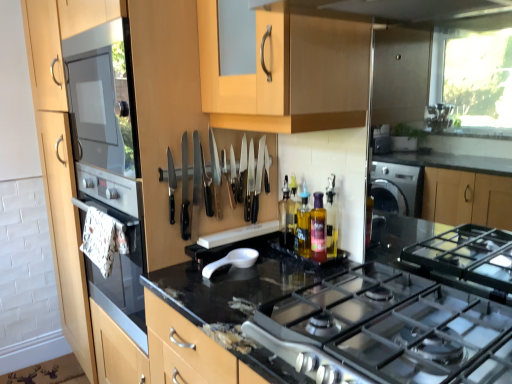
Where is `black granite countertop at center`? The height and width of the screenshot is (384, 512). black granite countertop at center is located at coordinates (349, 321).

The width and height of the screenshot is (512, 384). I want to click on translucent plastic bottle at center, the 3th bottle from the back, so click(318, 229).

Describe the element at coordinates (233, 260) in the screenshot. I see `white matte spoon at center` at that location.

Find the location of a particular element. Image resolution: width=512 pixels, height=384 pixels. black granite countertop at center is located at coordinates (349, 321).

Does point (228, 261) come closer to viewer compared to point (319, 228)?

No, it is not.

Which of these two, white matte spoon at center or translucent plastic bottle at center, placed as the first bottle when sorted from front to back, stands taller?

translucent plastic bottle at center, placed as the first bottle when sorted from front to back.

Is white matte spoon at center aimed at translucent plastic bottle at center, the 3th bottle from the back?

No, white matte spoon at center is not facing towards translucent plastic bottle at center, the 3th bottle from the back.

From a real-world perspective, which object stands above the other?

translucent plastic bottle at center, placed as the first bottle when sorted from front to back.

From the image's perspective, is translucent plastic bottle at center, the 3th bottle from the back, over black granite countertop at center?

Indeed, from the image's perspective, translucent plastic bottle at center, the 3th bottle from the back, is shown above black granite countertop at center.

In the scene shown: Which of these two, translucent plastic bottle at center, the 3th bottle from the back, or black granite countertop at center, stands taller?

black granite countertop at center is taller.

Consider the image. Which is less distant, (x=321, y=248) or (x=510, y=353)?

Clearly, point (x=321, y=248) is more distant from the camera than point (x=510, y=353).

Which object is closer to the camera taking this photo, black plastic knives at center or translucent plastic bottle at center, placed as the first bottle when sorted from front to back?

Positioned in front is black plastic knives at center.

Can we say black plastic knives at center lies outside translucent plastic bottle at center, the 3th bottle from the back?

Yes.

Looking at this image, how much distance is there between black plastic knives at center and translucent plastic bottle at center, the 3th bottle from the back?

The distance of black plastic knives at center from translucent plastic bottle at center, the 3th bottle from the back, is 12.72 inches.

Between black plastic knives at center and translucent plastic bottle at center, the 3th bottle from the back, which one appears on the right side from the viewer's perspective?

translucent plastic bottle at center, the 3th bottle from the back, is more to the right.

Considering the positions of points (333, 257) and (260, 191), is point (333, 257) farther from camera compared to point (260, 191)?

No, it is in front of (260, 191).

Does translucent purple bottle at center, which is counted as the 2th bottle, starting from the back, have a lesser height compared to black plastic knives at center?

Yes.

Starting from the black plastic knives at center, which bottle is the 2nd one to the right? Please provide its 2D coordinates.

[(317, 225)]

Based on the photo, is translucent plastic bottle at center, the 3th bottle from the back, to the right of translucent plastic bottle at center, which is counted as the 1th bottle, starting from the back, from the viewer's perspective?

Yes, translucent plastic bottle at center, the 3th bottle from the back, is to the right of translucent plastic bottle at center, which is counted as the 1th bottle, starting from the back.

From the image's perspective, which one is positioned higher, translucent plastic bottle at center, the 3th bottle from the back, or translucent plastic bottle at center, which is counted as the 1th bottle, starting from the back?

translucent plastic bottle at center, which is counted as the 1th bottle, starting from the back, is shown above in the image.

Is translucent plastic bottle at center, placed as the first bottle when sorted from front to back, facing away from translucent plastic bottle at center, which is the 3th bottle in front-to-back order?

No, translucent plastic bottle at center, placed as the first bottle when sorted from front to back, is not facing away from translucent plastic bottle at center, which is the 3th bottle in front-to-back order.

How different are the orientations of translucent plastic bottle at center, the 3th bottle from the back, and translucent plastic bottle at center, which is counted as the 1th bottle, starting from the back, in degrees?

The angle between the facing direction of translucent plastic bottle at center, the 3th bottle from the back, and the facing direction of translucent plastic bottle at center, which is counted as the 1th bottle, starting from the back, is 0.00112 degrees.

Considering the sizes of black granite countertop at center and translucent purple bottle at center, which is counted as the 2th bottle, starting from the back, in the image, is black granite countertop at center bigger or smaller than translucent purple bottle at center, which is counted as the 2th bottle, starting from the back,?

In the image, black granite countertop at center appears to be larger than translucent purple bottle at center, which is counted as the 2th bottle, starting from the back.

From the image's perspective, which one is positioned higher, black granite countertop at center or translucent purple bottle at center, which is counted as the 2th bottle, starting from the back?

translucent purple bottle at center, which is counted as the 2th bottle, starting from the back, is shown above in the image.

At what (x,y) coordinates should I click in order to perform the action: click on the 3rd bottle located above the black granite countertop at center (from a real-world perspective). Please return your answer as a coordinate pair (x, y). The image size is (512, 384). Looking at the image, I should click on (317, 225).

Between white matte spoon at center and translucent purple bottle at center, acting as the 2th bottle starting from the front, which one has larger width?

white matte spoon at center.

From the image's perspective, which object appears higher, white matte spoon at center or translucent purple bottle at center, which is counted as the 2th bottle, starting from the back?

translucent purple bottle at center, which is counted as the 2th bottle, starting from the back, appears higher in the image.

Can you see white matte spoon at center touching translucent purple bottle at center, acting as the 2th bottle starting from the front?

white matte spoon at center and translucent purple bottle at center, acting as the 2th bottle starting from the front, are not in contact.

Locate an element on the screen. bottle that is the 3rd one above the white matte spoon at center (from a real-world perspective) is located at coordinates pos(317,225).

The height and width of the screenshot is (384, 512). Find the location of `bottle that is the 1st one above the white matte spoon at center (from a real-world perspective)`. bottle that is the 1st one above the white matte spoon at center (from a real-world perspective) is located at coordinates (318, 229).

Locate an element on the screen. The height and width of the screenshot is (384, 512). countertop below the translucent plastic bottle at center, placed as the first bottle when sorted from front to back (from a real-world perspective) is located at coordinates (349, 321).

Estimate the real-world distances between objects in this image. Which object is closer to black granite countertop at center, black plastic knives at center or white matte spoon at center?

white matte spoon at center is closer to black granite countertop at center.

When comparing their distances from translucent plastic bottle at center, the 3th bottle from the back, does white matte spoon at center or translucent purple bottle at center, acting as the 2th bottle starting from the front, seem further?

The object further to translucent plastic bottle at center, the 3th bottle from the back, is white matte spoon at center.

When comparing their distances from white matte spoon at center, does translucent purple bottle at center, acting as the 2th bottle starting from the front, or black granite countertop at center seem closer?

Based on the image, translucent purple bottle at center, acting as the 2th bottle starting from the front, appears to be nearer to white matte spoon at center.

From the image, which object appears to be farther from translucent purple bottle at center, which is counted as the 2th bottle, starting from the back, translucent plastic bottle at center, the 3th bottle from the back, or black plastic knives at center?

black plastic knives at center.

Considering their positions, is white matte spoon at center positioned further to black granite countertop at center than black plastic knives at center?

The object further to black granite countertop at center is black plastic knives at center.

Based on their spatial positions, is black granite countertop at center or translucent plastic bottle at center, placed as the first bottle when sorted from front to back, closer to translucent plastic bottle at center, which is the 3th bottle in front-to-back order?

translucent plastic bottle at center, placed as the first bottle when sorted from front to back.

Looking at the image, which one is located further to black plastic knives at center, translucent purple bottle at center, acting as the 2th bottle starting from the front, or translucent plastic bottle at center, the 3th bottle from the back?

translucent plastic bottle at center, the 3th bottle from the back.

Which object lies further to the anchor point black plastic knives at center, translucent plastic bottle at center, the 3th bottle from the back, or black granite countertop at center?

black granite countertop at center is positioned further to the anchor black plastic knives at center.

Locate an element on the screen. The height and width of the screenshot is (384, 512). bottle between black plastic knives at center and translucent purple bottle at center, acting as the 2th bottle starting from the front, in the horizontal direction is located at coordinates (287, 217).

You are a GUI agent. You are given a task and a screenshot of the screen. Output one action in this format:
    pyautogui.click(x=<x>, y=<y>)
    Task: Click on the bottle between black granite countertop at center and translucent purple bottle at center, which is counted as the 2th bottle, starting from the back, from front to back
    
    Given the screenshot: What is the action you would take?
    pyautogui.click(x=318, y=229)

This screenshot has height=384, width=512. I want to click on appliance between black plastic knives at center and black granite countertop at center in the vertical direction, so click(x=233, y=260).

Identify the location of cutlery between white matte spoon at center and translucent plastic bottle at center, placed as the first bottle when sorted from front to back. This screenshot has width=512, height=384. [242, 173].